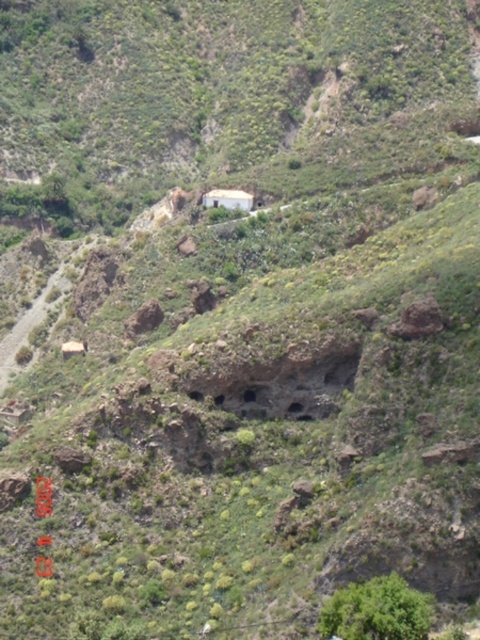
Question: Is green leafy bush at lower right in front of white matte hut at center?

Choices:
 (A) no
 (B) yes

Answer: (B)

Question: Which of the following is the farthest from the observer?

Choices:
 (A) (219, 196)
 (B) (342, 637)

Answer: (A)

Question: Which object appears closest to the camera in this image?

Choices:
 (A) white matte hut at center
 (B) green leafy bush at lower right

Answer: (B)

Question: Considering the relative positions of green leafy bush at lower right and white matte hut at center in the image provided, where is green leafy bush at lower right located with respect to white matte hut at center?

Choices:
 (A) left
 (B) right

Answer: (B)

Question: Considering the relative positions of green leafy bush at lower right and white matte hut at center in the image provided, where is green leafy bush at lower right located with respect to white matte hut at center?

Choices:
 (A) above
 (B) below

Answer: (B)